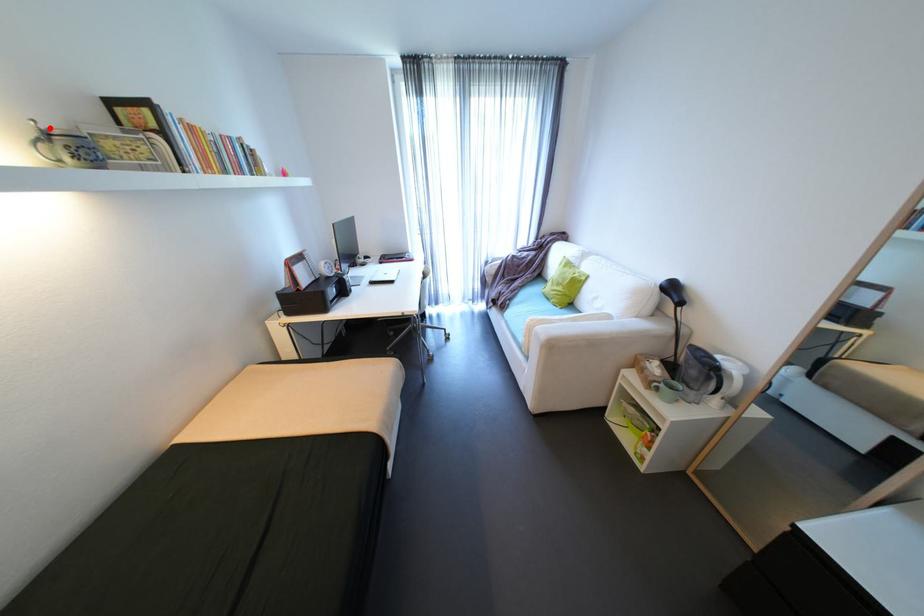
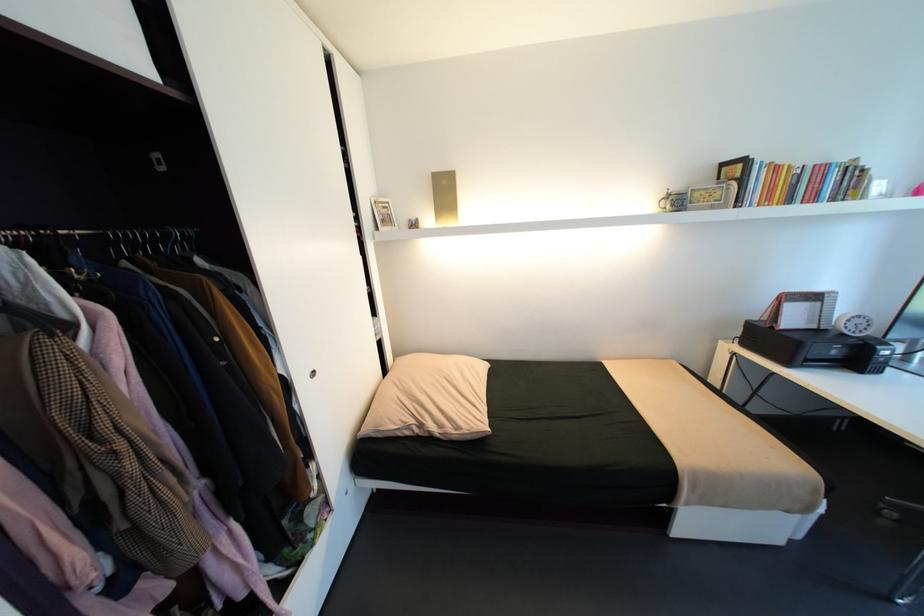
In the second image, find the point that corresponds to the highlighted location in the first image.

(676, 192)